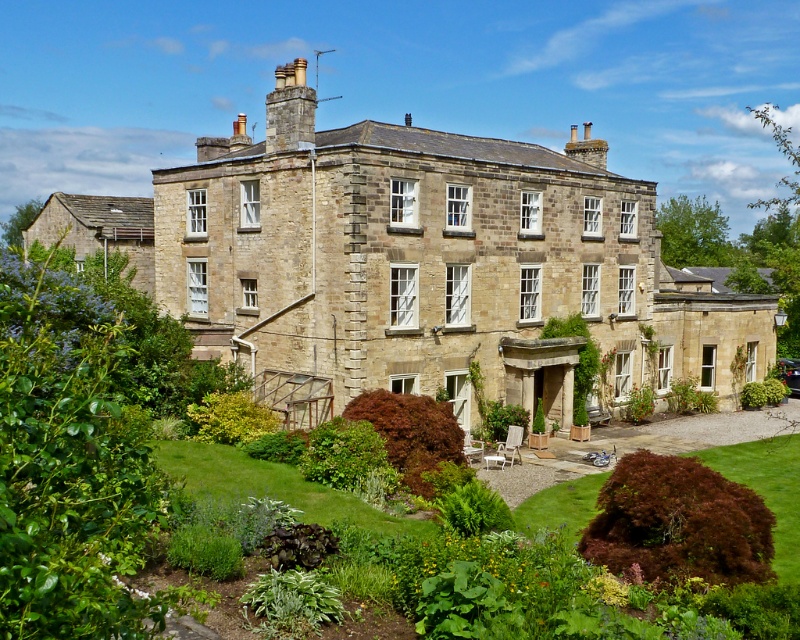
You are standing at point [92,444] in the garden of the historic building. What can you see directly in front of you?

You can see a green leafy bush at center directly in front of you at point [92,444].

You are standing in the garden of the historic building and want to take a photo of the green leafy bush at center. If your camera has a maximum focus range of 20 feet, will you need to move closer to capture it clearly?

The green leafy bush at center is 21.78 feet away from the camera, which exceeds the camera maximum focus range of 20 feet. Therefore, you need to move closer to ensure the green leafy bush at center is in focus.